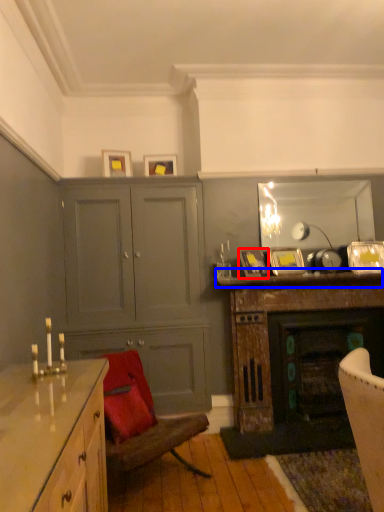
Question: Which point is further to the camera, picture frame (highlighted by a red box) or mantle (highlighted by a blue box)?

Choices:
 (A) picture frame
 (B) mantle

Answer: (A)